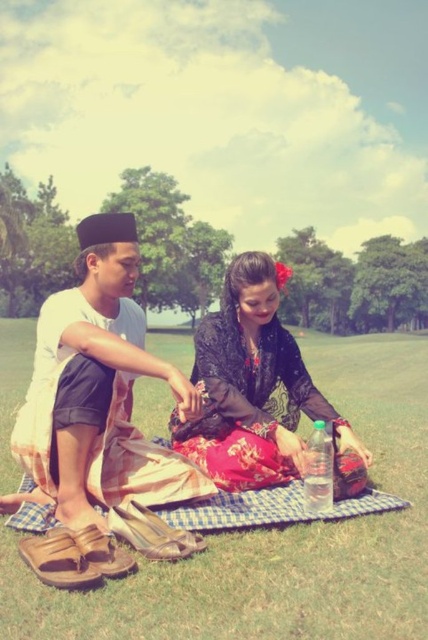
You are planning to place a small picnic basket on the green grass at center and the brown leather sandals at lower left. Which location has more space to accommodate the basket without overlapping other items?

The green grass at center has more space because its width surpasses that of the brown leather sandals at lower left, making it a better fit for placing the basket without overlapping.